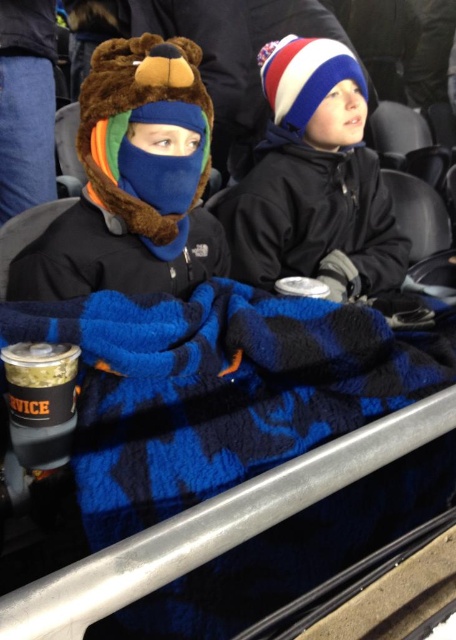
Who is positioned more to the right, blue fleece blanket at lower center or white/red/blue knit hat at center?

Positioned to the right is white/red/blue knit hat at center.

Between point (227, 362) and point (250, 212), which one is positioned in front?

Point (227, 362)

Identify the location of blue fleece blanket at lower center. (218, 388).

Which is below, blue fleece blanket at lower center or fuzzy brown bear hat at center?

blue fleece blanket at lower center is below.

Can you confirm if blue fleece blanket at lower center is thinner than fuzzy brown bear hat at center?

Incorrect, blue fleece blanket at lower center's width is not less than fuzzy brown bear hat at center's.

This screenshot has width=456, height=640. Describe the element at coordinates (218, 388) in the screenshot. I see `blue fleece blanket at lower center` at that location.

Find the location of a particular element. blue fleece blanket at lower center is located at coordinates tap(218, 388).

Does fuzzy brown bear hat at center have a larger size compared to white/red/blue knit hat at center?

Actually, fuzzy brown bear hat at center might be smaller than white/red/blue knit hat at center.

Can you confirm if fuzzy brown bear hat at center is positioned to the right of white/red/blue knit hat at center?

Incorrect, fuzzy brown bear hat at center is not on the right side of white/red/blue knit hat at center.

Measure the distance between point (122, 260) and camera.

Point (122, 260) and camera are 1.09 meters apart from each other.

Where is `fuzzy brown bear hat at center`? The height and width of the screenshot is (640, 456). fuzzy brown bear hat at center is located at coordinates (134, 182).